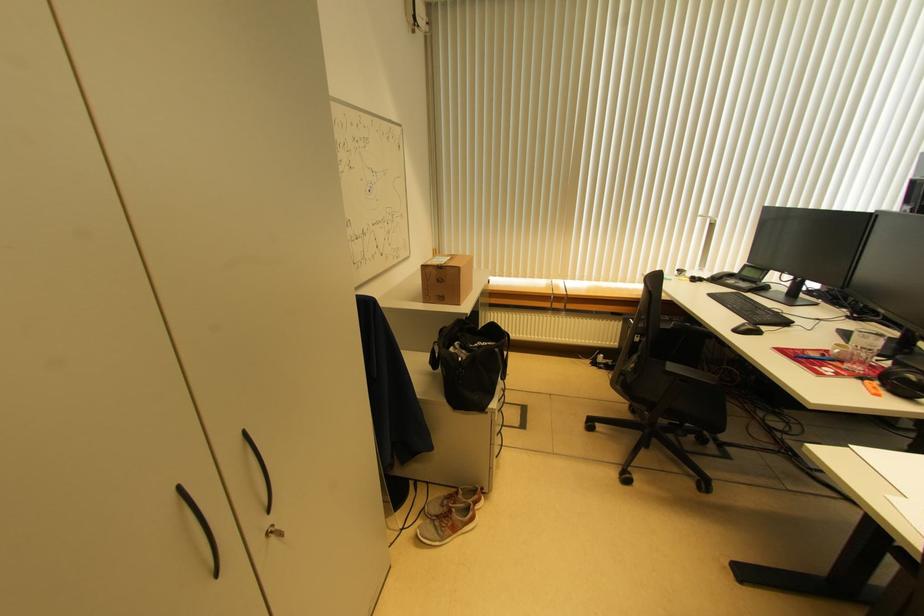
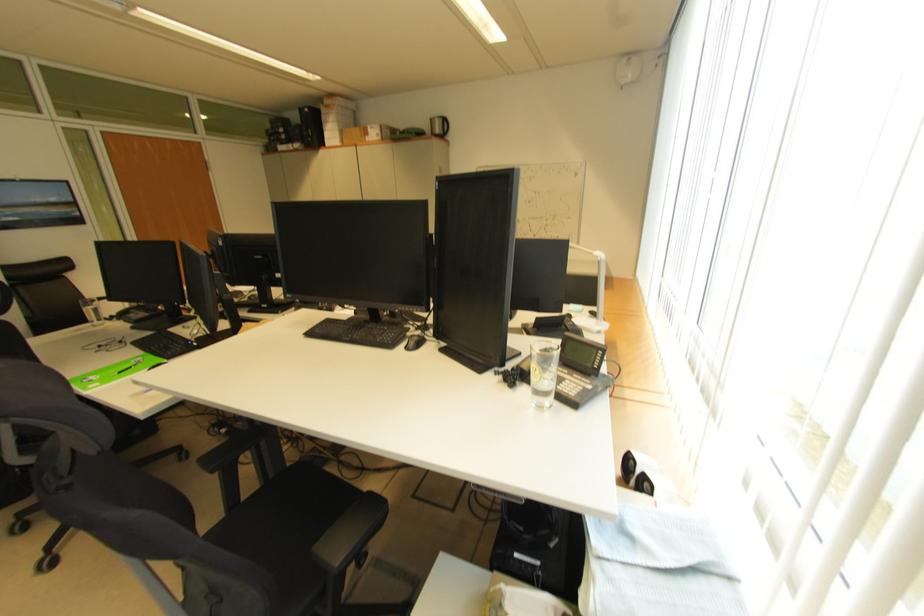
Question: I am providing you with two images of the same scene from different viewpoints. Please identify which objects are invisible in image2.

Choices:
 (A) chair armrest
 (B) black computer mouse
 (C) black chair armrest
 (D) blind pull knob

Answer: (A)